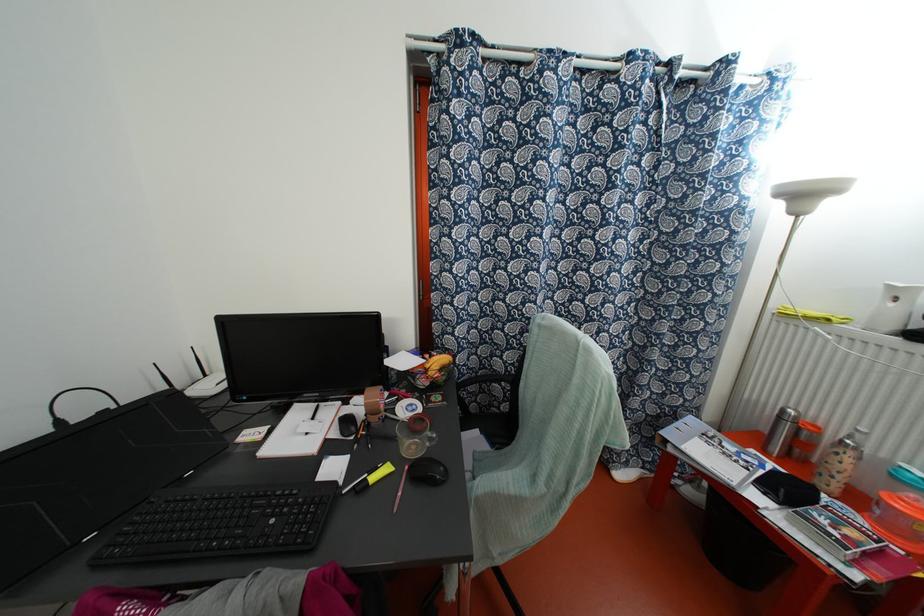
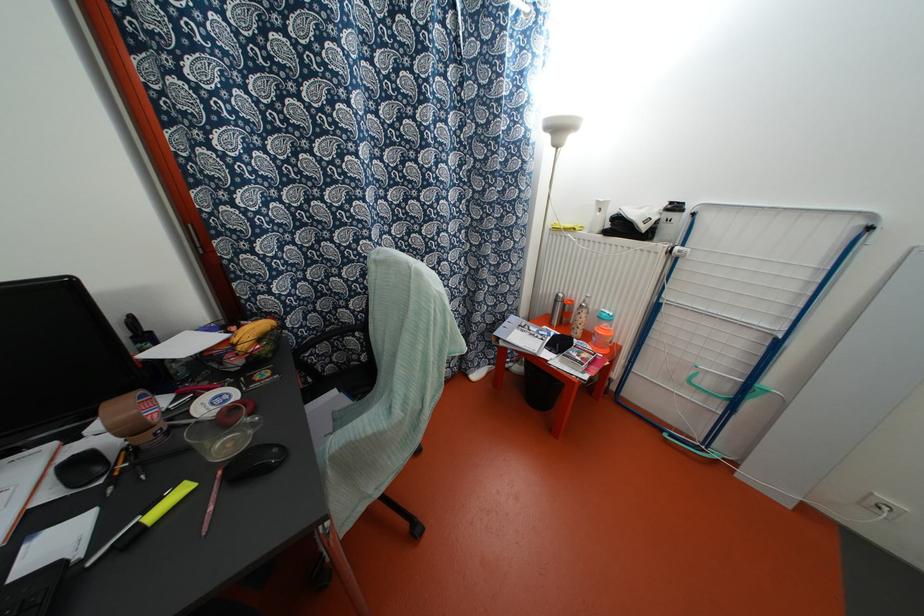
Question: The first image is from the beginning of the video and the second image is from the end. How did the camera likely rotate when shooting the video?

Choices:
 (A) Left
 (B) Right
 (C) Up
 (D) Down

Answer: (B)